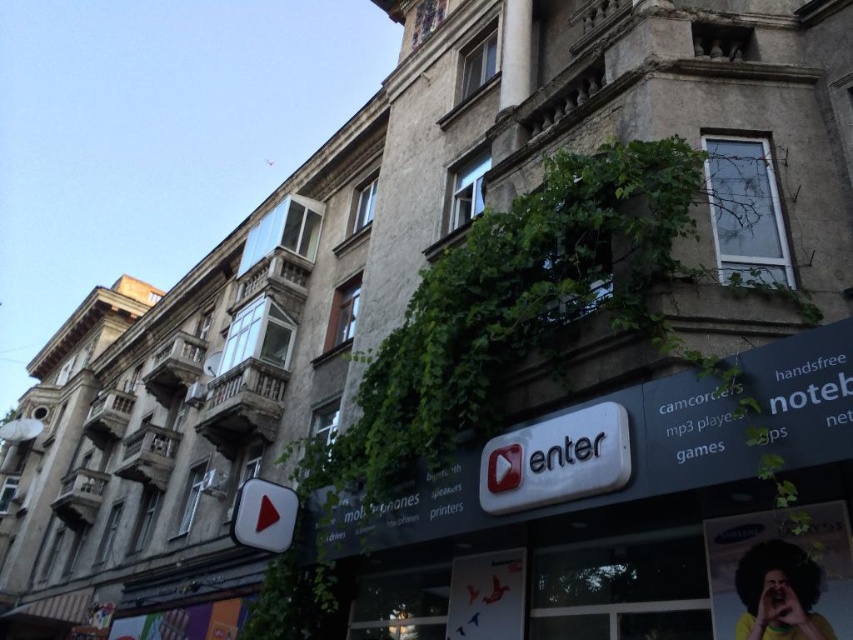
Question: Does white plastic sign at center have a larger size compared to shiny red play button at lower left?

Choices:
 (A) no
 (B) yes

Answer: (B)

Question: Does white plastic sign at center appear over shiny red play button at lower left?

Choices:
 (A) yes
 (B) no

Answer: (A)

Question: Can you confirm if white plastic sign at center is positioned below shiny red play button at lower left?

Choices:
 (A) no
 (B) yes

Answer: (A)

Question: Which object appears farthest from the camera in this image?

Choices:
 (A) shiny red play button at lower left
 (B) white plastic sign at center

Answer: (A)

Question: Which point appears farthest from the camera in this image?

Choices:
 (A) (242, 524)
 (B) (532, 444)

Answer: (A)

Question: Which point is closer to the camera?

Choices:
 (A) shiny red play button at lower left
 (B) white plastic sign at center

Answer: (B)